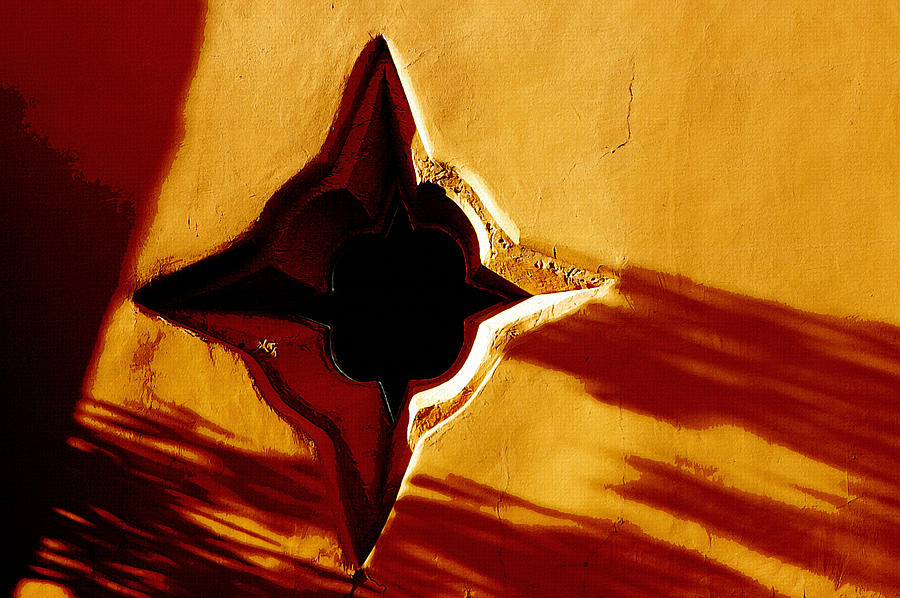
What are the coordinates of `corner` in the screenshot? It's located at (120, 292).